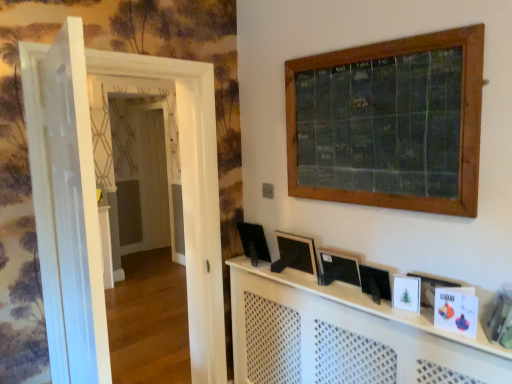
Find the location of `free space underneath black plastic computer screen at center (from a real-world perspective)`. free space underneath black plastic computer screen at center (from a real-world perspective) is located at coordinates (254, 259).